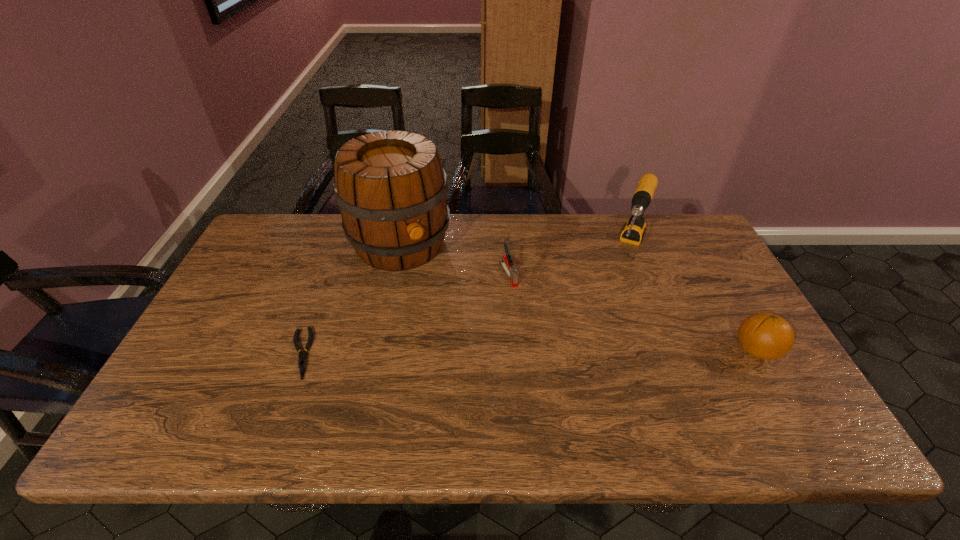
Identify the location of free spot between the rightmost object and the shortest object. (528, 352).

Identify the location of free space between the second tallest object and the rightmost object. (693, 299).

You are a GUI agent. You are given a task and a screenshot of the screen. Output one action in this format:
    pyautogui.click(x=<x>, y=<y>)
    Task: Click on the free space between the tallest object and the fourth object from left to right
    This screenshot has width=960, height=540.
    Given the screenshot: What is the action you would take?
    pyautogui.click(x=515, y=245)

Where is `empty space between the cider and the shortest object`? This screenshot has height=540, width=960. empty space between the cider and the shortest object is located at coordinates (350, 299).

You are a GUI agent. You are given a task and a screenshot of the screen. Output one action in this format:
    pyautogui.click(x=<x>, y=<y>)
    Task: Click on the free space between the fourth shortest object and the cider
    This screenshot has height=540, width=960.
    Given the screenshot: What is the action you would take?
    pyautogui.click(x=515, y=245)

The image size is (960, 540). I want to click on vacant area that lies between the pliers and the rightmost object, so click(x=528, y=352).

Where is `vacant space that's between the second object from right to left and the orange`? The image size is (960, 540). vacant space that's between the second object from right to left and the orange is located at coordinates (693, 299).

The width and height of the screenshot is (960, 540). I want to click on free space between the fourth shortest object and the pliers, so click(465, 300).

Image resolution: width=960 pixels, height=540 pixels. I want to click on vacant space that's between the shortest object and the cider, so click(x=350, y=299).

I want to click on object that is the closest to the orange, so click(634, 229).